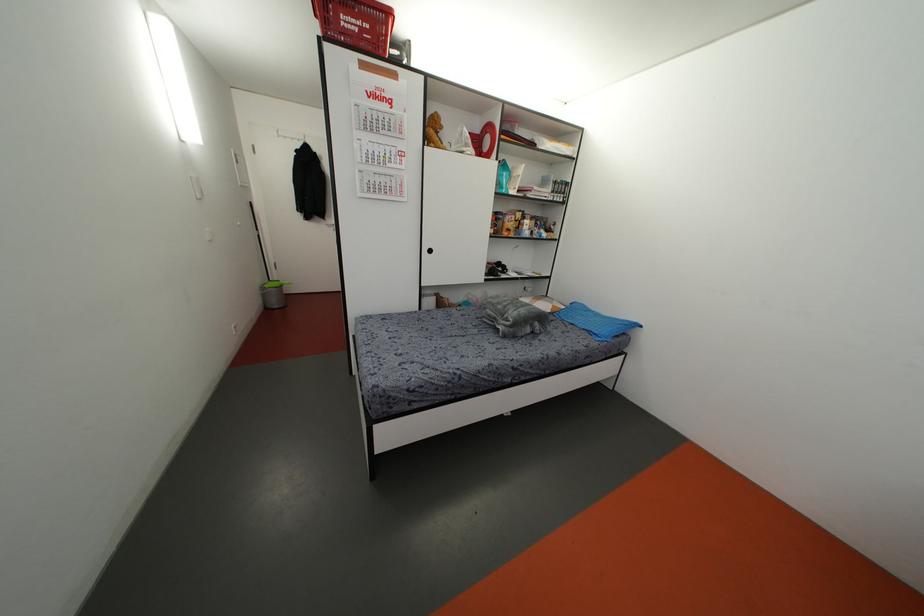
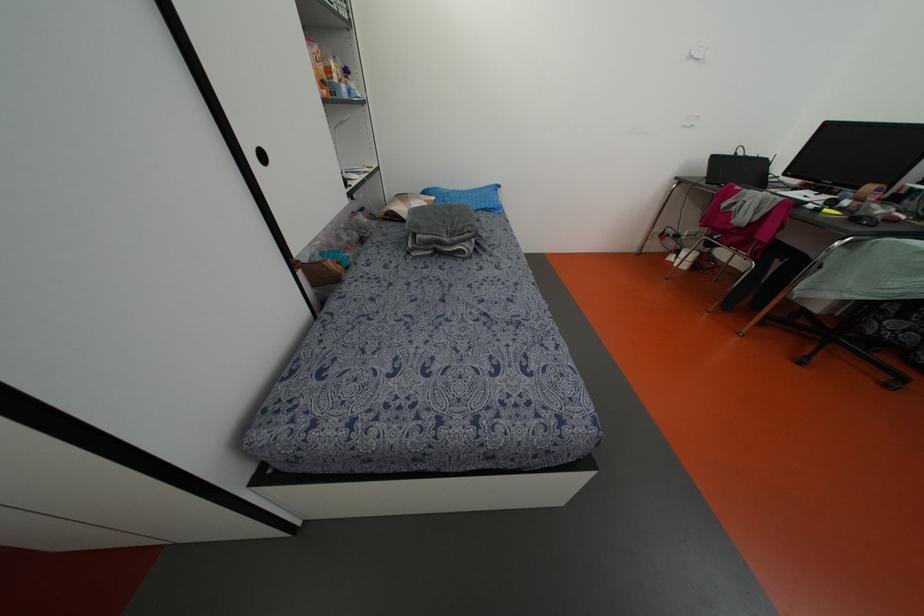
Where in the second image is the point corresponding to (x=596, y=331) from the first image?

(492, 206)